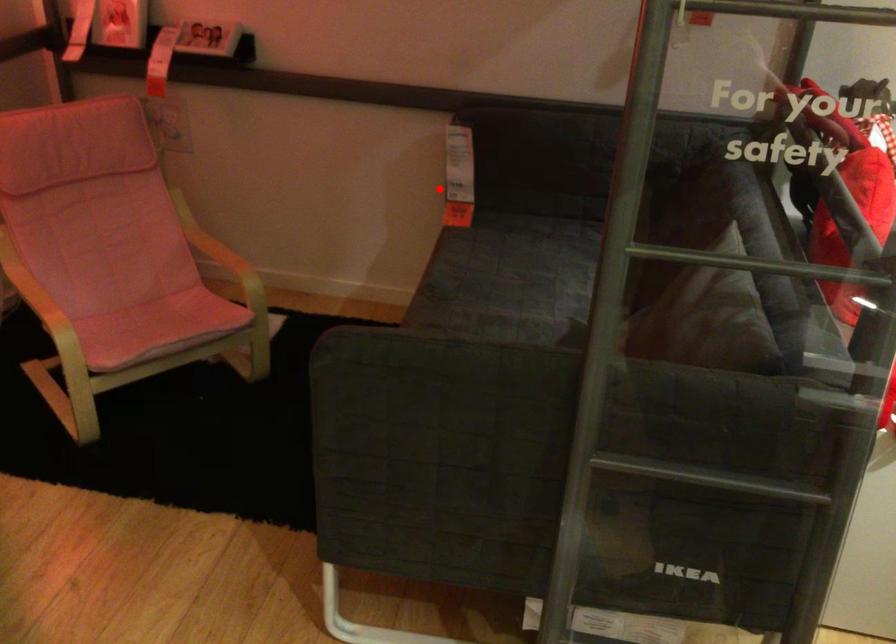
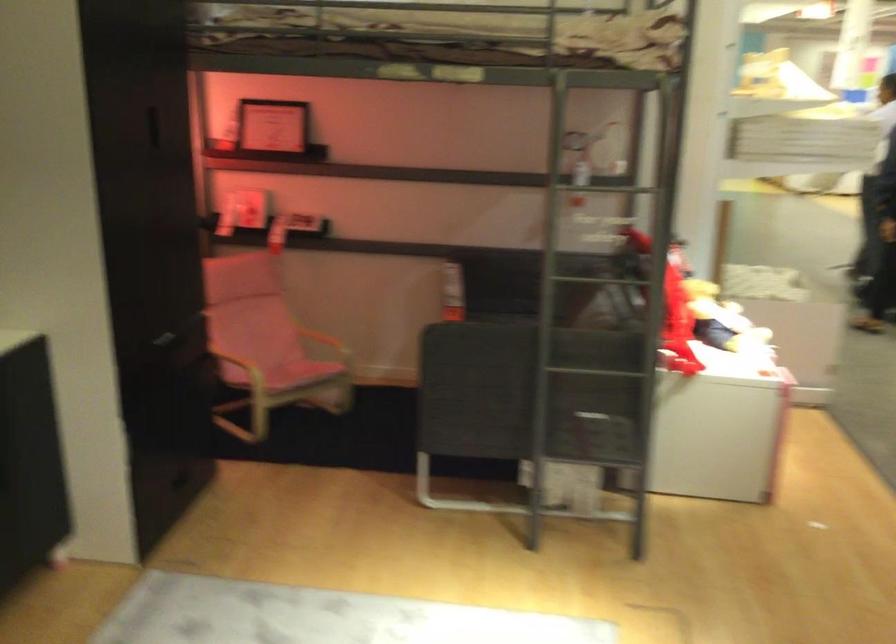
Question: I am providing you with two images of the same scene from different viewpoints. Image1 has a red point marked. In image2, the corresponding 3D location appears at what relative position? Reply with the corresponding letter.

Choices:
 (A) Closer
 (B) Farther

Answer: (B)